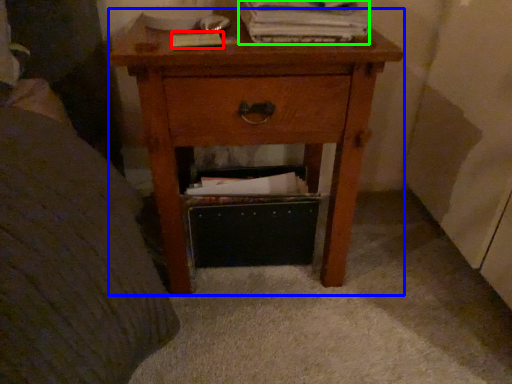
Question: Considering the real-world distances, which object is closest to paperback book (highlighted by a red box)? nightstand (highlighted by a blue box) or paperback book (highlighted by a green box).

Choices:
 (A) nightstand
 (B) paperback book

Answer: (B)